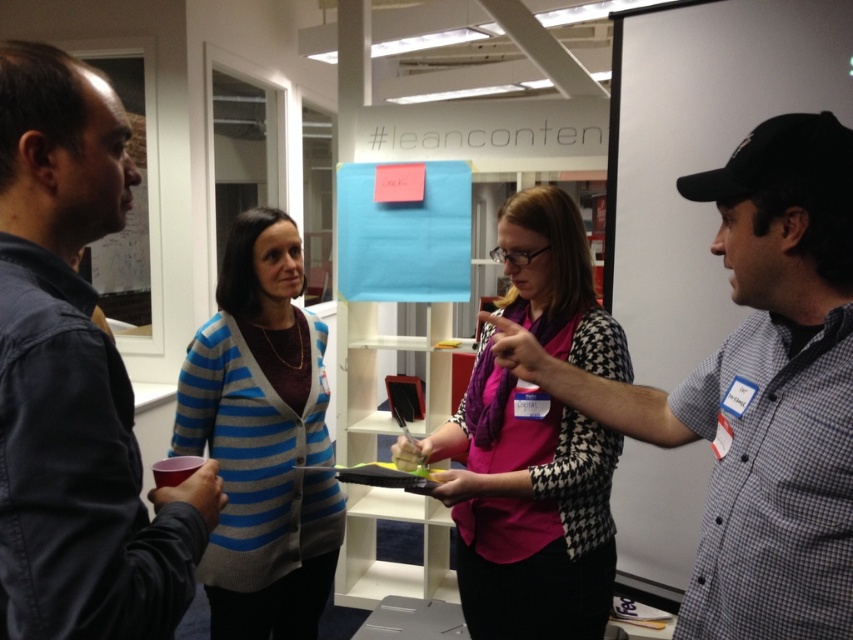
You are a photographer standing at the camera position. You want to take a photo of the dark blue denim jacket at left without moving the jacket. Can you focus on it clearly?

The dark blue denim jacket at left is 28.25 inches from camera, so yes, you can focus on it clearly as it is within the camera focus range.

You are organizing a presentation and need to choose between the pink fabric scarf at center and the blue striped cardigan at center as a prop. Which item would you select if you want the prop to be more noticeable to the audience?

The pink fabric scarf at center is larger in size than the blue striped cardigan at center, so it would be more noticeable to the audience.